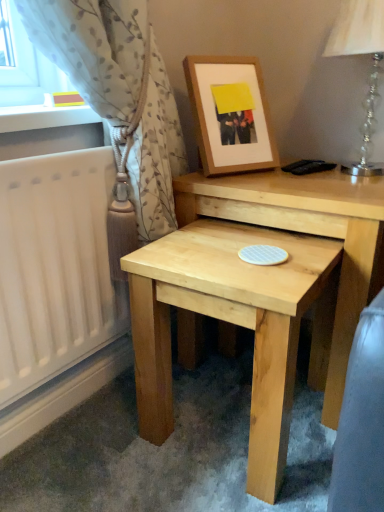
Where is `vacant region under clear crystal glass table lamp at upper right (from a real-world perspective)`? The width and height of the screenshot is (384, 512). vacant region under clear crystal glass table lamp at upper right (from a real-world perspective) is located at coordinates (340, 177).